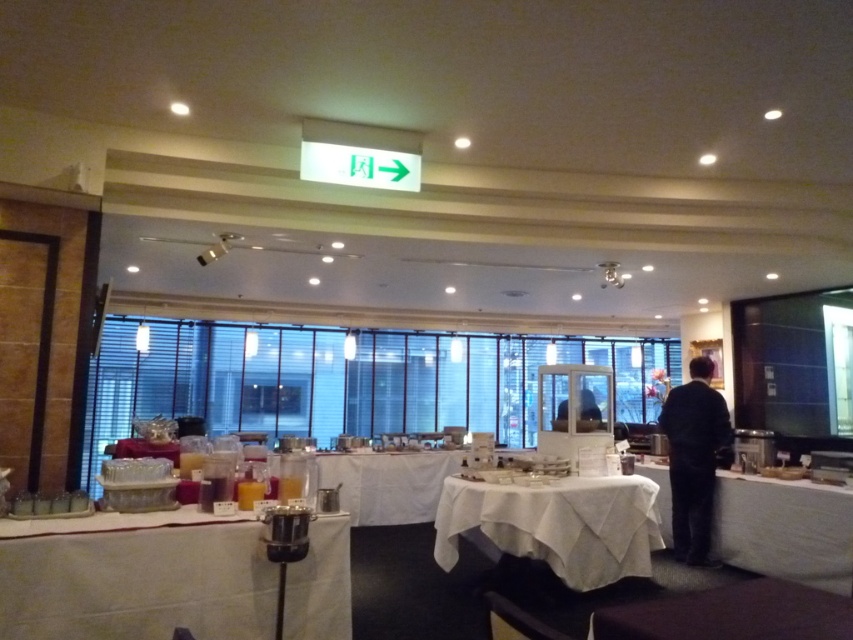
Question: Observing the image, what is the correct spatial positioning of white cloth-covered table at center in reference to dark suit at right?

Choices:
 (A) below
 (B) above

Answer: (A)

Question: Which of the following is the closest to the observer?

Choices:
 (A) (572, 476)
 (B) (88, 596)
 (C) (695, 531)
 (D) (656, 497)

Answer: (B)

Question: Considering the relative positions of maroon fabric table at lower right and dark suit at right in the image provided, where is maroon fabric table at lower right located with respect to dark suit at right?

Choices:
 (A) left
 (B) right

Answer: (A)

Question: Estimate the real-world distances between objects in this image. Which object is closer to the white cloth-covered table at center?

Choices:
 (A) metallic silver pot at lower left
 (B) white cloth-covered table at lower right
 (C) dark suit at right
 (D) maroon fabric table at lower right

Answer: (C)

Question: Observing the image, what is the correct spatial positioning of white cloth-covered table at lower right in reference to maroon fabric table at lower right?

Choices:
 (A) below
 (B) above

Answer: (A)

Question: Among these points, which one is nearest to the camera?

Choices:
 (A) (659, 636)
 (B) (694, 536)

Answer: (A)